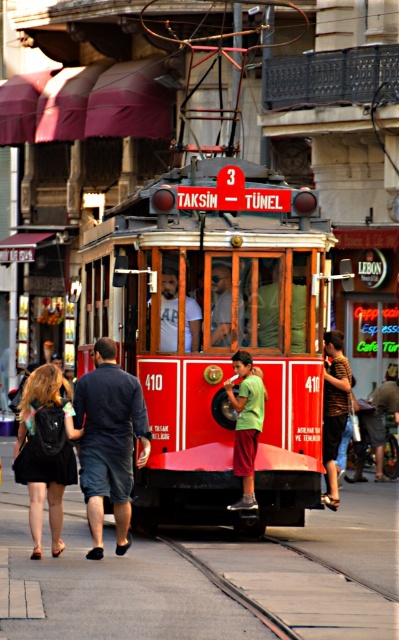
Question: Is black backpack at lower left positioned before striped shirt at center?

Choices:
 (A) yes
 (B) no

Answer: (A)

Question: Can you confirm if black backpack at lower left is bigger than striped shirt at center?

Choices:
 (A) yes
 (B) no

Answer: (A)

Question: Which point is closer to the camera taking this photo?

Choices:
 (A) (98, 256)
 (B) (86, 381)
 (C) (199, 321)
 (D) (262, 376)

Answer: (B)

Question: Is red polished wood tram at center smaller than black backpack at lower left?

Choices:
 (A) no
 (B) yes

Answer: (B)

Question: Which of the following is the closest to the observer?

Choices:
 (A) striped shirt at center
 (B) green matte shirt at center

Answer: (B)

Question: Which object is farther from the camera taking this photo?

Choices:
 (A) striped shirt at center
 (B) green matte shirt at center

Answer: (A)